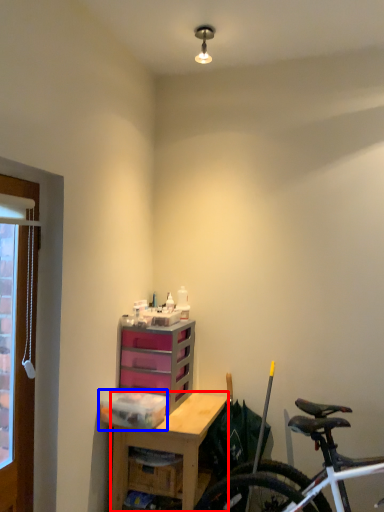
Question: Which point is further to the camera, desk (highlighted by a red box) or storage box (highlighted by a blue box)?

Choices:
 (A) desk
 (B) storage box

Answer: (B)